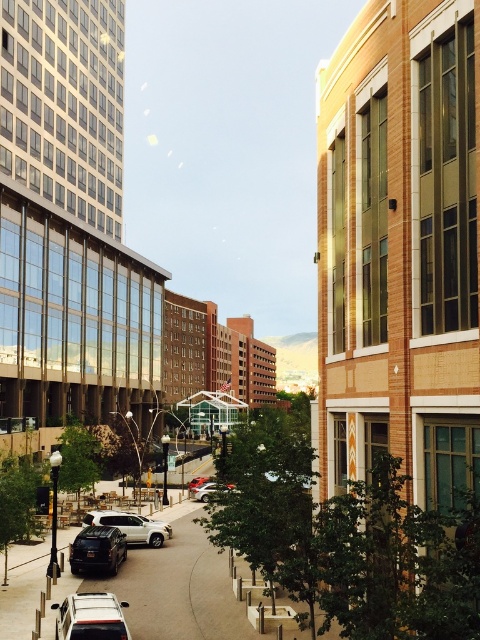
Question: Among these points, which one is nearest to the camera?

Choices:
 (A) (96, 547)
 (B) (131, 536)

Answer: (A)

Question: Does silver metallic suv at lower left appear over white matte suv at center?

Choices:
 (A) yes
 (B) no

Answer: (A)

Question: Is white matte suv at center to the left of silver metallic car at center from the viewer's perspective?

Choices:
 (A) yes
 (B) no

Answer: (A)

Question: Does silver metallic suv at lower left appear over silver metallic car at center?

Choices:
 (A) no
 (B) yes

Answer: (B)

Question: Which object is closer to the camera taking this photo?

Choices:
 (A) silver metallic car at center
 (B) white matte suv at center
 (C) silver metallic suv at lower left
 (D) shiny black suv at center

Answer: (C)

Question: Among these objects, which one is farthest from the camera?

Choices:
 (A) shiny black suv at center
 (B) silver metallic car at center

Answer: (B)